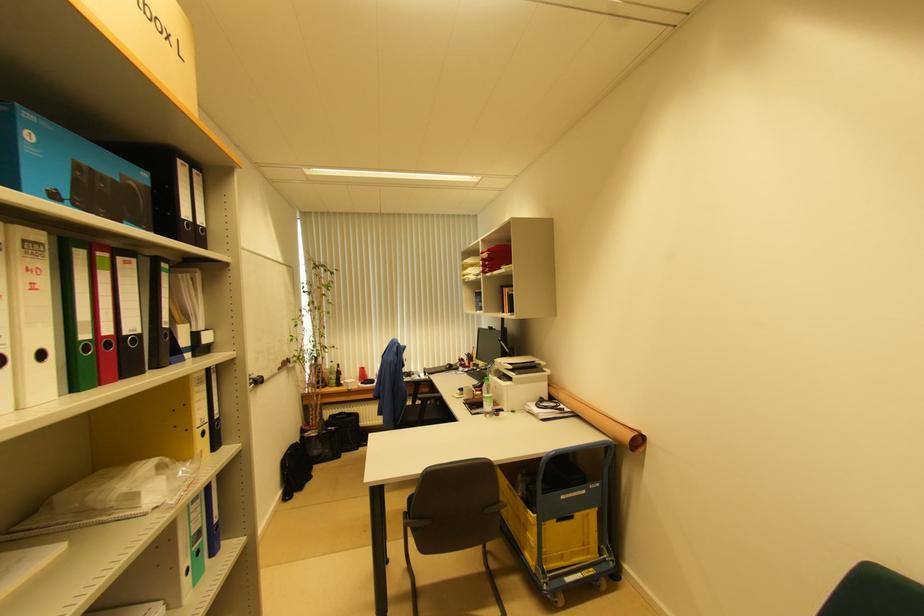
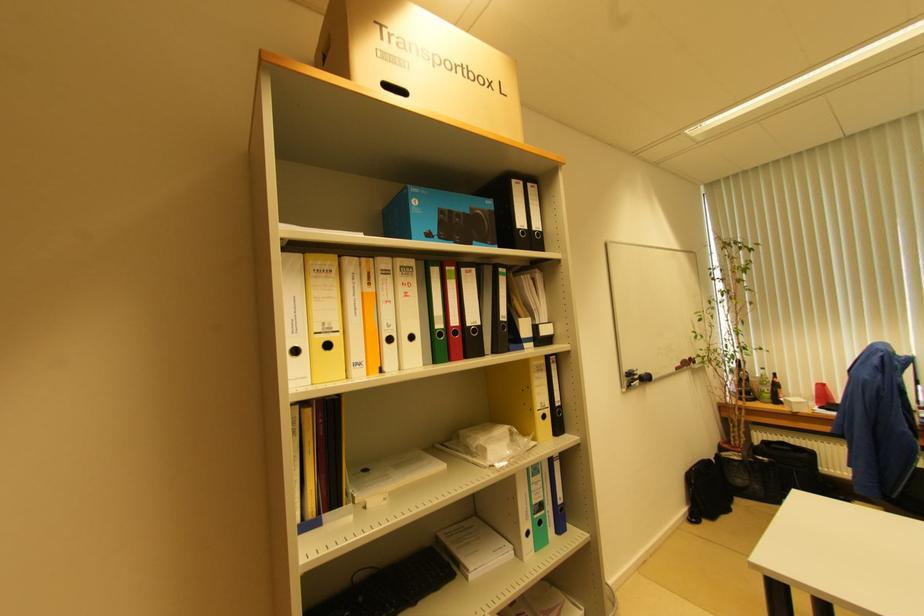
Question: The camera is either moving clockwise (left) or counter-clockwise (right) around the object. The first image is from the beginning of the video and the second image is from the end. Is the camera moving left or right when shooting the video?

Choices:
 (A) Left
 (B) Right

Answer: (B)